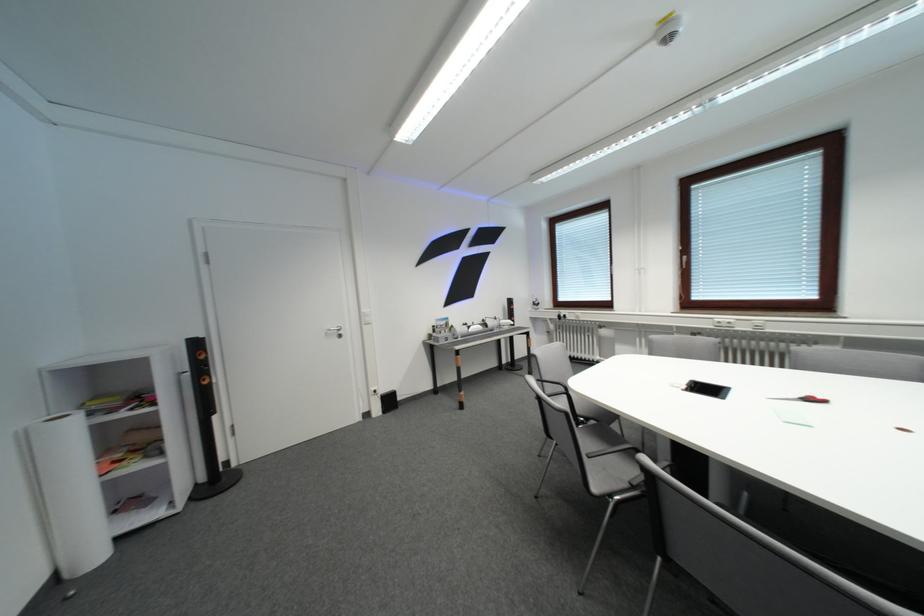
This screenshot has height=616, width=924. In order to click on silver door handle in this screenshot , I will do `click(334, 331)`.